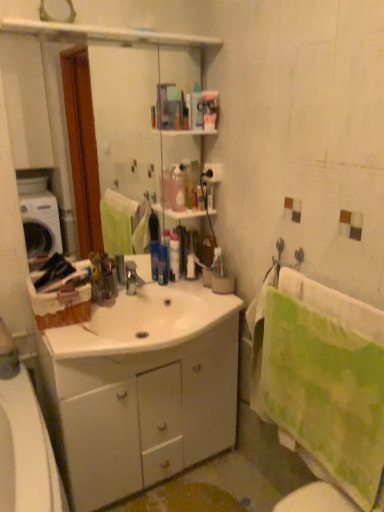
Locate an element on the screen. Image resolution: width=384 pixels, height=512 pixels. empty space that is to the right of blue glossy bottle at center, the 4th toiletry positioned from the right is located at coordinates (180, 285).